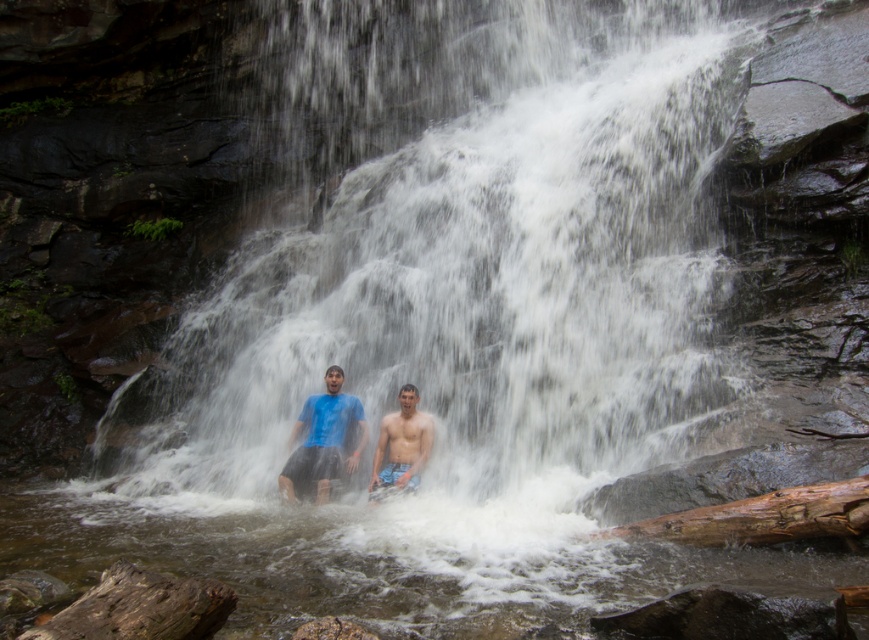
Question: Can you confirm if white frothy water at center is smaller than blue fabric shorts at lower center?

Choices:
 (A) yes
 (B) no

Answer: (B)

Question: Does white frothy water at center have a larger size compared to brown rough log at lower right?

Choices:
 (A) no
 (B) yes

Answer: (B)

Question: Which of the following is the closest to the observer?

Choices:
 (A) (276, 435)
 (B) (304, 419)
 (C) (415, 416)

Answer: (C)

Question: Which object is positioned farthest from the brown rough log at lower right?

Choices:
 (A) white frothy water at center
 (B) blue matte shirt at center
 (C) blue fabric shorts at lower center

Answer: (A)

Question: Estimate the real-world distances between objects in this image. Which object is farther from the blue fabric shorts at lower center?

Choices:
 (A) brown rough log at lower right
 (B) white frothy water at center

Answer: (A)

Question: Is brown rough log at lower right positioned in front of blue matte shirt at center?

Choices:
 (A) yes
 (B) no

Answer: (A)